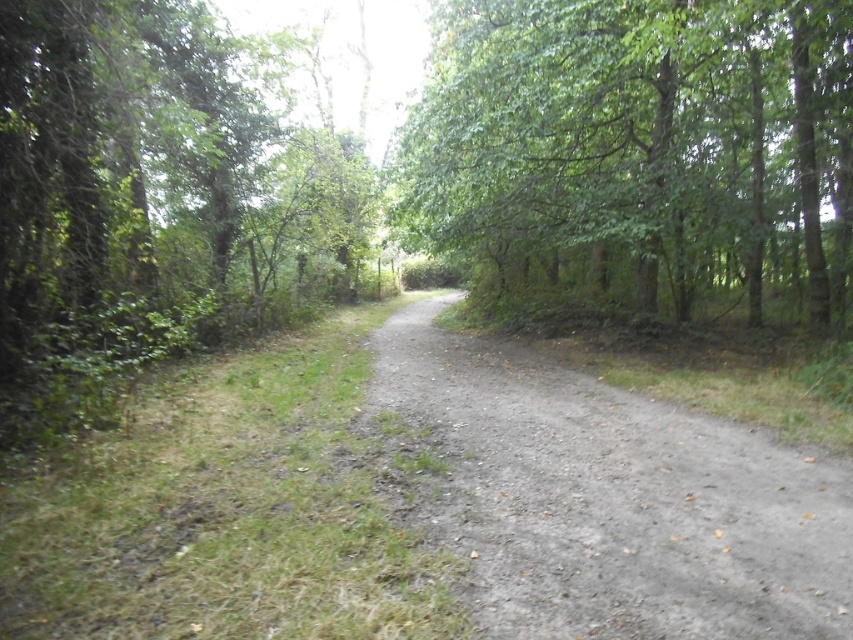
Does green leafy tree at upper right have a lesser height compared to green leafy tree at left?

Incorrect, green leafy tree at upper right's height does not fall short of green leafy tree at left's.

Is green leafy tree at upper right to the left of green leafy tree at left from the viewer's perspective?

In fact, green leafy tree at upper right is to the right of green leafy tree at left.

Who is more forward, (x=666, y=106) or (x=213, y=179)?

Positioned in front is point (x=666, y=106).

Identify the location of green leafy tree at upper right. The width and height of the screenshot is (853, 640). (636, 157).

Which is in front, point (64, 166) or point (792, 624)?

Point (792, 624)

Is point (103, 280) positioned after point (642, 563)?

Yes, point (103, 280) is behind point (642, 563).

Is point (109, 8) more distant than point (598, 476)?

Yes, point (109, 8) is behind point (598, 476).

Identify the location of green leafy tree at left. The height and width of the screenshot is (640, 853). (149, 202).

Can you confirm if green leafy tree at upper right is positioned above dirt/gravel path at center?

Yes, green leafy tree at upper right is above dirt/gravel path at center.

Find the location of a particular element. This screenshot has height=640, width=853. green leafy tree at upper right is located at coordinates point(636,157).